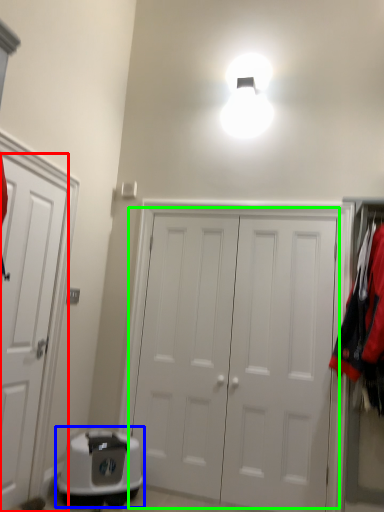
Question: Based on their relative distances, which object is farther from door (highlighted by a red box)? Choose from appliance (highlighted by a blue box) and door (highlighted by a green box).

Choices:
 (A) appliance
 (B) door

Answer: (B)